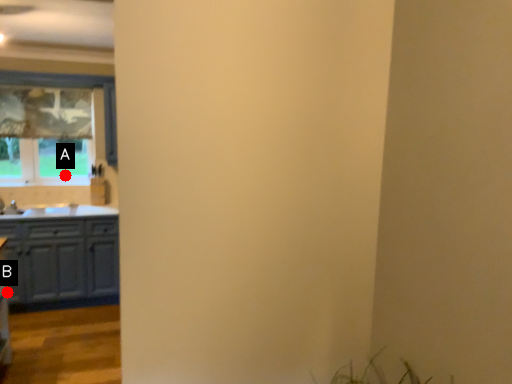
Question: Two points are circled on the image, labeled by A and B beside each circle. Which of the following is the closest to the observer?

Choices:
 (A) A is closer
 (B) B is closer

Answer: (B)